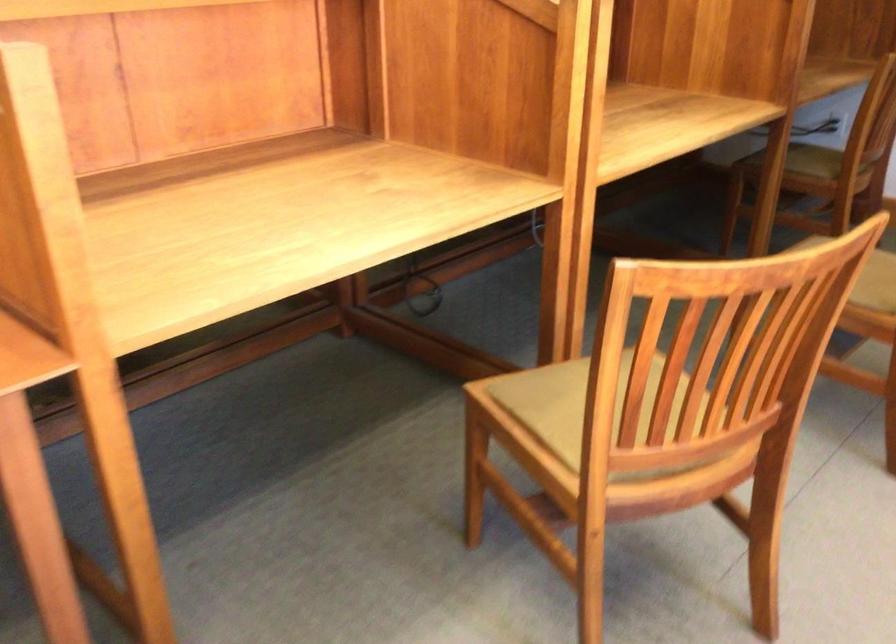
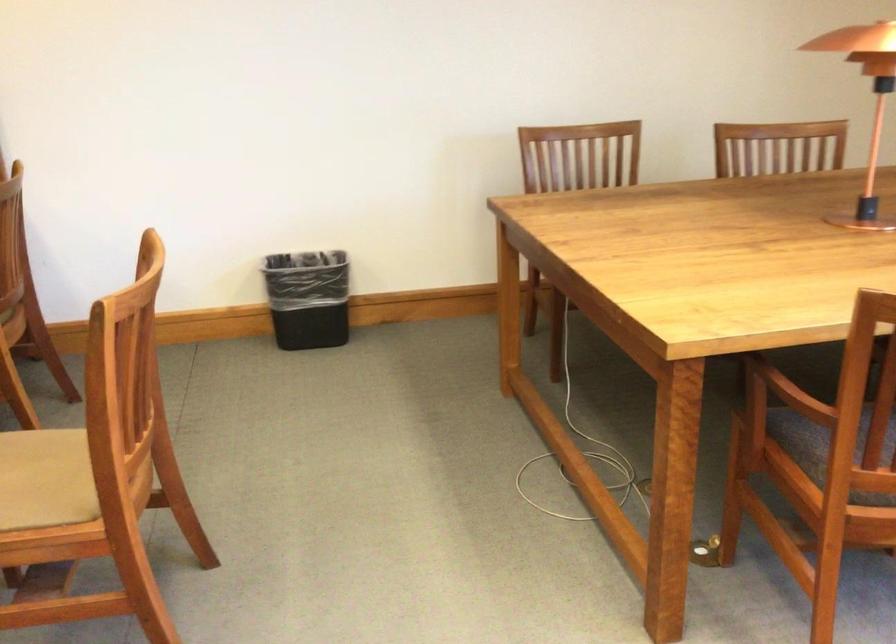
Question: The camera is either moving clockwise (left) or counter-clockwise (right) around the object. The first image is from the beginning of the video and the second image is from the end. Is the camera moving left or right when shooting the video?

Choices:
 (A) Left
 (B) Right

Answer: (A)